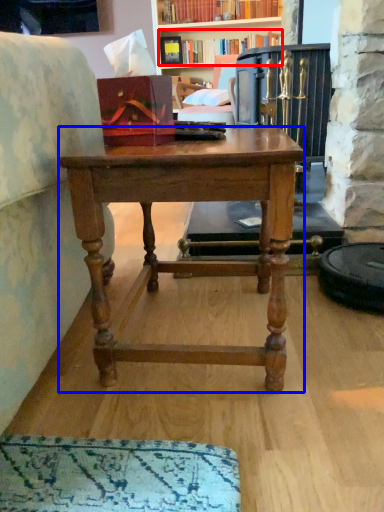
Question: Among these objects, which one is farthest to the camera, book (highlighted by a red box) or desk (highlighted by a blue box)?

Choices:
 (A) book
 (B) desk

Answer: (A)